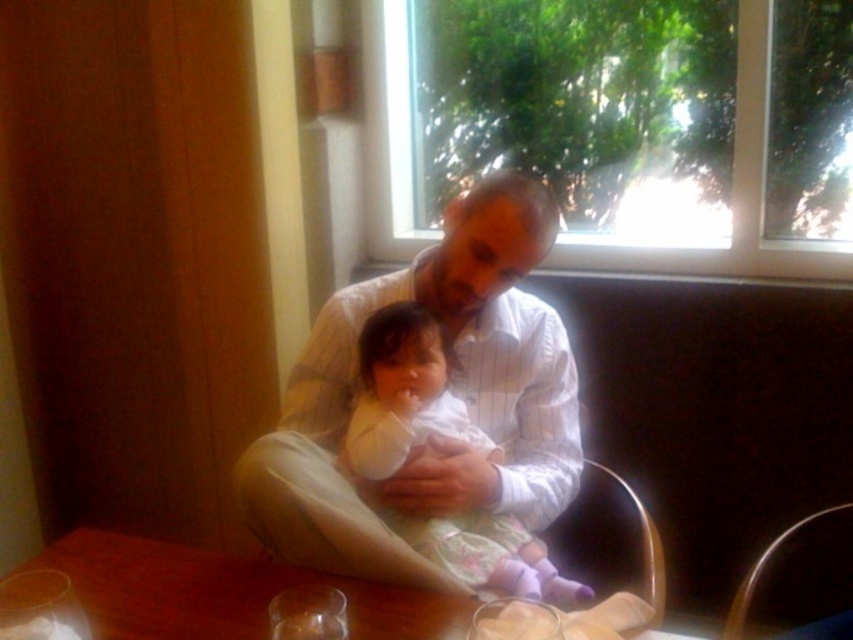
Is white striped shirt at center above white soft fabric baby at center?

Yes, white striped shirt at center is above white soft fabric baby at center.

Does white striped shirt at center lie behind white soft fabric baby at center?

No, it is in front of white soft fabric baby at center.

This screenshot has height=640, width=853. Identify the location of white striped shirt at center. (453, 392).

I want to click on white striped shirt at center, so click(x=453, y=392).

Does white soft fabric baby at center have a lesser width compared to brown wooden table at center?

Indeed, white soft fabric baby at center has a lesser width compared to brown wooden table at center.

Between white soft fabric baby at center and brown wooden table at center, which one appears on the right side from the viewer's perspective?

white soft fabric baby at center is more to the right.

Does point (489, 586) lie in front of point (357, 589)?

No.

Locate an element on the screen. white soft fabric baby at center is located at coordinates (405, 397).

Is white striped shirt at center in front of brown wooden table at center?

No, white striped shirt at center is behind brown wooden table at center.

Locate an element on the screen. The width and height of the screenshot is (853, 640). white striped shirt at center is located at coordinates (453, 392).